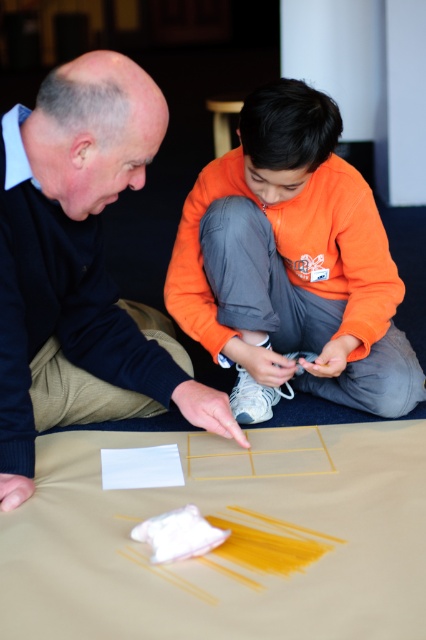
Does point (152, 339) lie behind point (382, 298)?

That is False.

Which is above, matte black sweater at left or orange fabric at center?

orange fabric at center

Who is more distant from viewer, (0, 419) or (314, 144)?

The point (314, 144) is more distant.

This screenshot has width=426, height=640. Find the location of `matte black sweater at left`. matte black sweater at left is located at coordinates (80, 268).